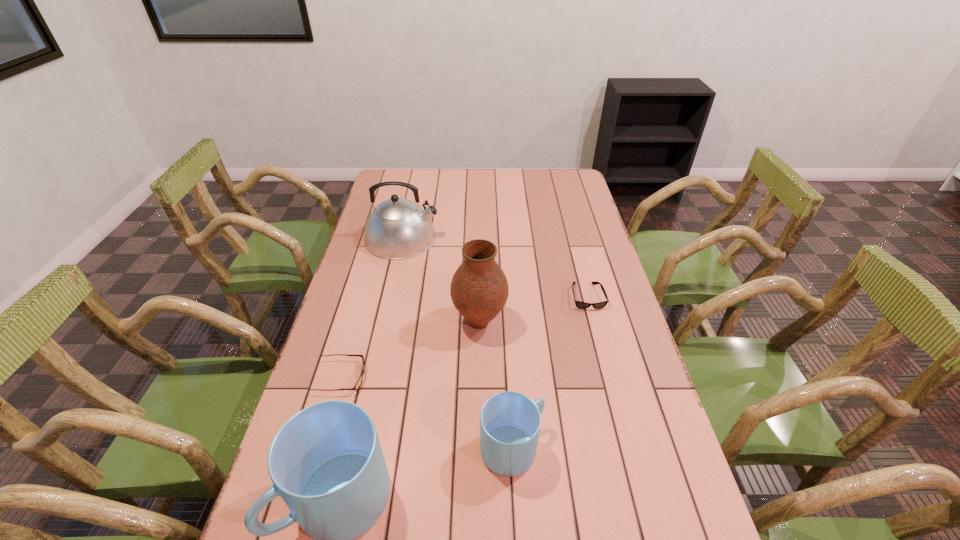
Locate an element on the screen. vacant space located 0.200m from the spout of the kettle is located at coordinates pyautogui.click(x=492, y=238).

At what (x,y) coordinates should I click in order to perform the action: click on vacant point located 0.270m on the front-facing side of the rightmost object. Please return your answer as a coordinate pair (x, y). This screenshot has height=540, width=960. Looking at the image, I should click on (610, 383).

At what (x,y) coordinates should I click in order to perform the action: click on vacant space situated 0.100m on the front-facing side of the third nearest object. Please return your answer as a coordinate pair (x, y). The height and width of the screenshot is (540, 960). Looking at the image, I should click on (403, 377).

The width and height of the screenshot is (960, 540). I want to click on kettle that is at the left edge, so click(x=398, y=228).

The width and height of the screenshot is (960, 540). Identify the location of sunglasses that is positioned at the left edge. (356, 387).

This screenshot has height=540, width=960. I want to click on object that is at the right edge, so click(x=579, y=304).

In the image, there is a desktop. At what (x,y) coordinates should I click in order to perform the action: click on vacant space at the left edge. Please return your answer as a coordinate pair (x, y). Looking at the image, I should click on (339, 395).

Identify the location of vacant space at the right edge of the desktop. (582, 200).

The image size is (960, 540). In order to click on vacant space at the far left corner of the desktop in this screenshot , I will do `click(410, 189)`.

This screenshot has width=960, height=540. What are the coordinates of `blank region between the vase and the rightmost object` in the screenshot? It's located at (533, 309).